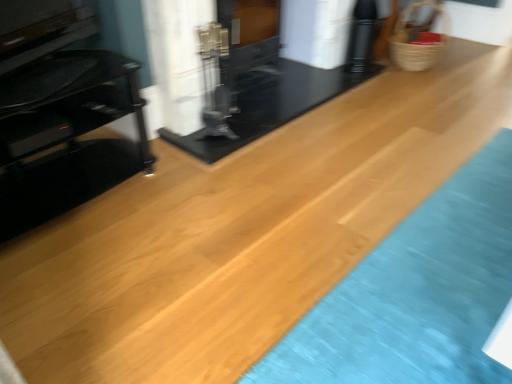
Where is `black glossy fireplace at center, marked as the 2th fireplace in a right-to-left arrangement`? The width and height of the screenshot is (512, 384). black glossy fireplace at center, marked as the 2th fireplace in a right-to-left arrangement is located at coordinates (234, 56).

What is the approximate height of black glossy fireplace at center, which is counted as the 1th fireplace, starting from the right?

black glossy fireplace at center, which is counted as the 1th fireplace, starting from the right, is 65.95 centimeters tall.

Identify the location of black glass tv stand at left. (60, 114).

Considering the points (406, 34) and (207, 42), which point is in front, point (406, 34) or point (207, 42)?

The point (207, 42) is in front.

Between woven straw basket at upper right and black glossy fireplace at center, marked as the 2th fireplace in a right-to-left arrangement, which one has smaller size?

woven straw basket at upper right is smaller.

Considering the relative positions of woven straw basket at upper right and black glossy fireplace at center, the first fireplace viewed from the left, in the image provided, is woven straw basket at upper right to the left or to the right of black glossy fireplace at center, the first fireplace viewed from the left,?

woven straw basket at upper right is to the right of black glossy fireplace at center, the first fireplace viewed from the left.

From the image's perspective, which is below, woven straw basket at upper right or black glossy fireplace at center, the first fireplace viewed from the left?

From the image's view, black glossy fireplace at center, the first fireplace viewed from the left, is below.

Which of these two, black glossy fireplace at center, marked as the 2th fireplace in a right-to-left arrangement, or black glossy fireplace at center, which is counted as the 1th fireplace, starting from the right, stands shorter?

Standing shorter between the two is black glossy fireplace at center, marked as the 2th fireplace in a right-to-left arrangement.

Is the depth of black glossy fireplace at center, the first fireplace viewed from the left, less than that of black glossy fireplace at center, which is counted as the 1th fireplace, starting from the right?

No, black glossy fireplace at center, the first fireplace viewed from the left, is behind black glossy fireplace at center, which is counted as the 1th fireplace, starting from the right.

Between black glossy fireplace at center, marked as the 2th fireplace in a right-to-left arrangement, and black glossy fireplace at center, marked as the second fireplace in a left-to-right arrangement, which one has larger size?

black glossy fireplace at center, marked as the second fireplace in a left-to-right arrangement.

Is black glossy fireplace at center, marked as the 2th fireplace in a right-to-left arrangement, positioned beyond the bounds of black glossy fireplace at center, marked as the second fireplace in a left-to-right arrangement?

Actually, black glossy fireplace at center, marked as the 2th fireplace in a right-to-left arrangement, is within black glossy fireplace at center, marked as the second fireplace in a left-to-right arrangement.

From the image's perspective, is black glass tv stand at left above or below woven straw basket at upper right?

Clearly, from the image's perspective, black glass tv stand at left is below woven straw basket at upper right.

Which point is more distant from viewer, (42,102) or (404,21)?

Positioned behind is point (404,21).

Between black glass tv stand at left and woven straw basket at upper right, which one is positioned behind?

woven straw basket at upper right is more distant.

Is black glass tv stand at left shorter than woven straw basket at upper right?

No, black glass tv stand at left is not shorter than woven straw basket at upper right.

Which is in front, woven straw basket at upper right or black glass tv stand at left?

Positioned in front is black glass tv stand at left.

Considering the relative sizes of woven straw basket at upper right and black glass tv stand at left in the image provided, is woven straw basket at upper right taller than black glass tv stand at left?

Incorrect, the height of woven straw basket at upper right is not larger of that of black glass tv stand at left.

From a real-world perspective, is woven straw basket at upper right on black glass tv stand at left?

No, from a real-world perspective, woven straw basket at upper right is not over black glass tv stand at left

Are black glossy fireplace at center, which is counted as the 1th fireplace, starting from the right, and black glossy fireplace at center, marked as the 2th fireplace in a right-to-left arrangement, located far from each other?

Actually, black glossy fireplace at center, which is counted as the 1th fireplace, starting from the right, and black glossy fireplace at center, marked as the 2th fireplace in a right-to-left arrangement, are a little close together.

From the image's perspective, which one is positioned lower, black glossy fireplace at center, marked as the second fireplace in a left-to-right arrangement, or black glossy fireplace at center, marked as the 2th fireplace in a right-to-left arrangement?

black glossy fireplace at center, marked as the second fireplace in a left-to-right arrangement, appears lower in the image.

Is black glossy fireplace at center, marked as the second fireplace in a left-to-right arrangement, wider than black glossy fireplace at center, marked as the 2th fireplace in a right-to-left arrangement?

Yes.

Considering the relative positions of black glossy fireplace at center, which is counted as the 1th fireplace, starting from the right, and black glossy fireplace at center, the first fireplace viewed from the left, in the image provided, is black glossy fireplace at center, which is counted as the 1th fireplace, starting from the right, to the left of black glossy fireplace at center, the first fireplace viewed from the left, from the viewer's perspective?

In fact, black glossy fireplace at center, which is counted as the 1th fireplace, starting from the right, is to the right of black glossy fireplace at center, the first fireplace viewed from the left.

Considering the relative sizes of black glossy fireplace at center, marked as the second fireplace in a left-to-right arrangement, and black glass tv stand at left in the image provided, is black glossy fireplace at center, marked as the second fireplace in a left-to-right arrangement, smaller than black glass tv stand at left?

No.

Considering the sizes of objects black glossy fireplace at center, which is counted as the 1th fireplace, starting from the right, and black glass tv stand at left in the image provided, who is taller, black glossy fireplace at center, which is counted as the 1th fireplace, starting from the right, or black glass tv stand at left?

black glossy fireplace at center, which is counted as the 1th fireplace, starting from the right.

Between point (404, 54) and point (234, 122), which one is positioned behind?

Positioned behind is point (404, 54).

Measure the distance from woven straw basket at upper right to black glossy fireplace at center, marked as the second fireplace in a left-to-right arrangement.

The distance of woven straw basket at upper right from black glossy fireplace at center, marked as the second fireplace in a left-to-right arrangement, is 38.31 inches.

Is woven straw basket at upper right wider or thinner than black glossy fireplace at center, which is counted as the 1th fireplace, starting from the right?

Considering their sizes, woven straw basket at upper right looks slimmer than black glossy fireplace at center, which is counted as the 1th fireplace, starting from the right.

Is woven straw basket at upper right at the left side of black glossy fireplace at center, marked as the second fireplace in a left-to-right arrangement?

No, woven straw basket at upper right is not to the left of black glossy fireplace at center, marked as the second fireplace in a left-to-right arrangement.

This screenshot has height=384, width=512. I want to click on basket below the black glossy fireplace at center, marked as the 2th fireplace in a right-to-left arrangement (from a real-world perspective), so click(x=416, y=44).

Where is `fireplace to the left of black glossy fireplace at center, which is counted as the 1th fireplace, starting from the right`? fireplace to the left of black glossy fireplace at center, which is counted as the 1th fireplace, starting from the right is located at coordinates (234, 56).

Which object lies further to the anchor point black glass tv stand at left, woven straw basket at upper right or black glossy fireplace at center, marked as the 2th fireplace in a right-to-left arrangement?

woven straw basket at upper right.

From the image, which object appears to be farther from black glass tv stand at left, black glossy fireplace at center, marked as the second fireplace in a left-to-right arrangement, or black glossy fireplace at center, the first fireplace viewed from the left?

Based on the image, black glossy fireplace at center, marked as the second fireplace in a left-to-right arrangement, appears to be further to black glass tv stand at left.

Considering their positions, is black glossy fireplace at center, which is counted as the 1th fireplace, starting from the right, positioned further to black glass tv stand at left than woven straw basket at upper right?

Among the two, woven straw basket at upper right is located further to black glass tv stand at left.

Based on their spatial positions, is woven straw basket at upper right or black glossy fireplace at center, the first fireplace viewed from the left, closer to black glossy fireplace at center, which is counted as the 1th fireplace, starting from the right?

Based on the image, black glossy fireplace at center, the first fireplace viewed from the left, appears to be nearer to black glossy fireplace at center, which is counted as the 1th fireplace, starting from the right.

Looking at the image, which one is located closer to woven straw basket at upper right, black glossy fireplace at center, the first fireplace viewed from the left, or black glass tv stand at left?

Among the two, black glossy fireplace at center, the first fireplace viewed from the left, is located nearer to woven straw basket at upper right.

From the image, which object appears to be farther from woven straw basket at upper right, black glass tv stand at left or black glossy fireplace at center, marked as the 2th fireplace in a right-to-left arrangement?

black glass tv stand at left.

Considering their positions, is woven straw basket at upper right positioned closer to black glossy fireplace at center, marked as the 2th fireplace in a right-to-left arrangement, than black glossy fireplace at center, marked as the second fireplace in a left-to-right arrangement?

Among the two, black glossy fireplace at center, marked as the second fireplace in a left-to-right arrangement, is located nearer to black glossy fireplace at center, marked as the 2th fireplace in a right-to-left arrangement.

Based on their spatial positions, is black glossy fireplace at center, marked as the second fireplace in a left-to-right arrangement, or black glossy fireplace at center, the first fireplace viewed from the left, closer to woven straw basket at upper right?

black glossy fireplace at center, marked as the second fireplace in a left-to-right arrangement, is positioned closer to the anchor woven straw basket at upper right.

Image resolution: width=512 pixels, height=384 pixels. I want to click on fireplace situated between black glossy fireplace at center, marked as the 2th fireplace in a right-to-left arrangement, and woven straw basket at upper right from left to right, so click(264, 84).

The image size is (512, 384). Identify the location of fireplace located between black glass tv stand at left and black glossy fireplace at center, the first fireplace viewed from the left, in the depth direction. (264, 84).